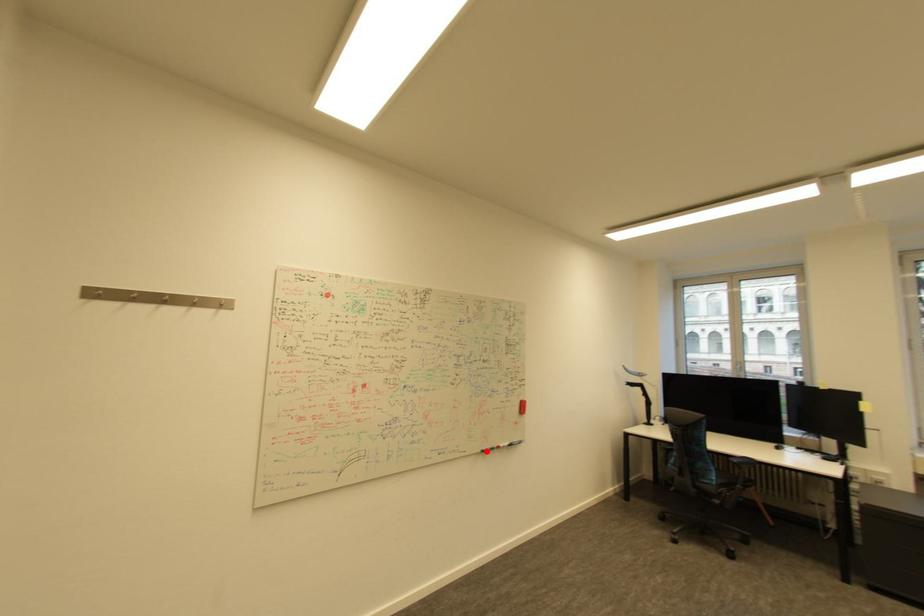
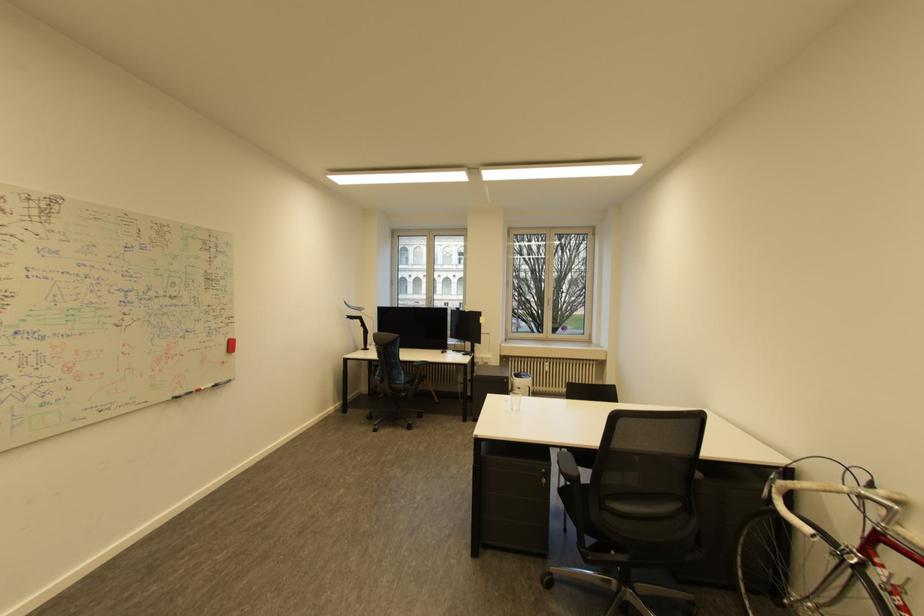
Question: A red point is marked in image1. In image2, is the corresponding 3D point closer to the camera or farther? Reply with the corresponding letter.

Choices:
 (A) The corresponding 3D point is closer.
 (B) The corresponding 3D point is farther.

Answer: (A)